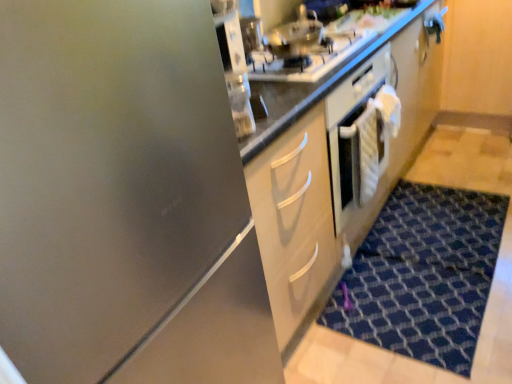
Locate an element on the screen. This screenshot has height=384, width=512. free region under blue textured rug at lower right (from a real-world perspective) is located at coordinates (433, 260).